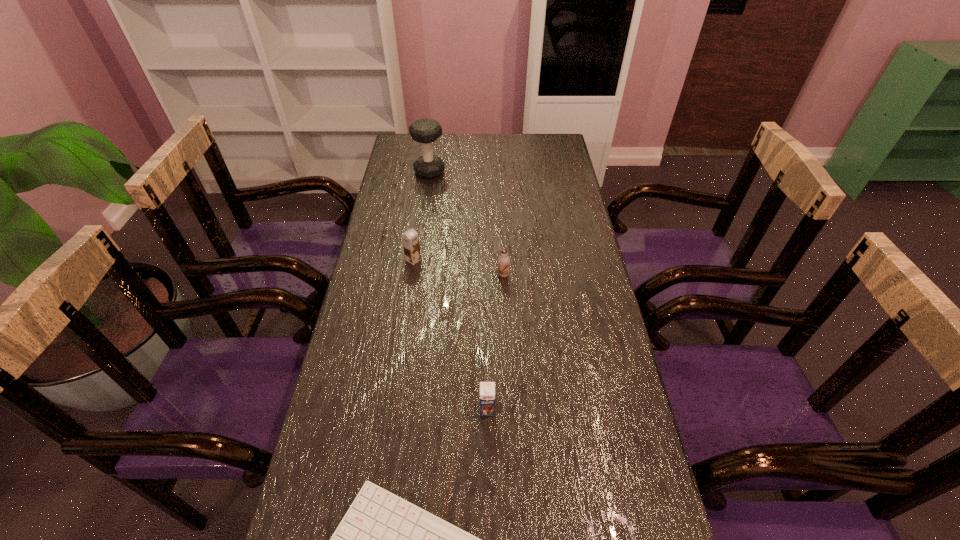
This screenshot has width=960, height=540. What are the coordinates of `the farthest object` in the screenshot? It's located at (425, 131).

Where is `dumbbell`? This screenshot has height=540, width=960. dumbbell is located at coordinates (425, 131).

Find the location of `the fourth nearest object`. the fourth nearest object is located at coordinates (410, 239).

Locate an element on the screen. The width and height of the screenshot is (960, 540). the farthest chocolate milk is located at coordinates (410, 239).

You are a GUI agent. You are given a task and a screenshot of the screen. Output one action in this format:
    pyautogui.click(x=<x>, y=<y>)
    Task: Click on the second farthest chocolate milk
    The image size is (960, 540).
    Given the screenshot: What is the action you would take?
    pyautogui.click(x=503, y=261)

The height and width of the screenshot is (540, 960). What are the coordinates of `the third farthest object` in the screenshot? It's located at (503, 261).

Identify the location of the second nearest object. The image size is (960, 540). (487, 389).

Locate an element on the screen. The height and width of the screenshot is (540, 960). the nearest chocolate milk is located at coordinates (487, 389).

Where is `vacant region located on the front of the farthest object`? This screenshot has width=960, height=540. vacant region located on the front of the farthest object is located at coordinates (425, 202).

At what (x,y) coordinates should I click in order to perform the action: click on free region located 0.280m on the front of the fourth nearest object. Please return your answer as a coordinate pair (x, y). The height and width of the screenshot is (540, 960). Looking at the image, I should click on (402, 336).